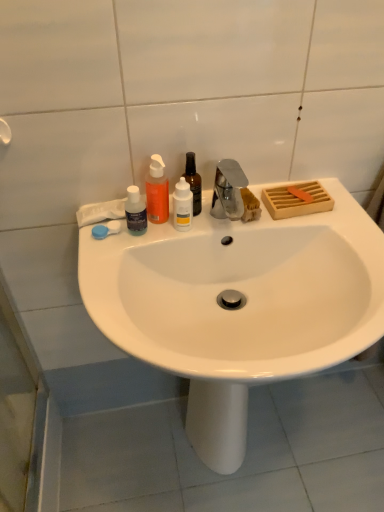
Locate an element on the screen. This screenshot has height=512, width=384. free space on the front side of transparent plastic bottle at center, the first bottle in the right-to-left sequence is located at coordinates (157, 243).